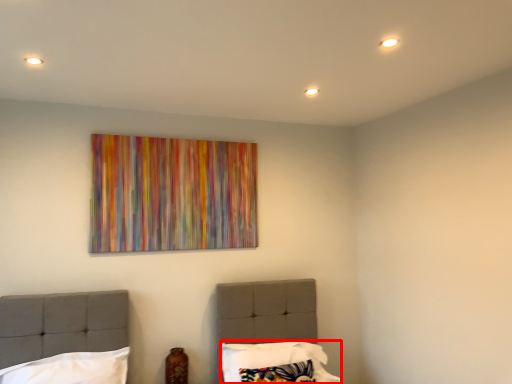
Question: From the image's perspective, what is the correct spatial relationship of pillow (annotated by the red box) in relation to pillow?

Choices:
 (A) below
 (B) above

Answer: (A)